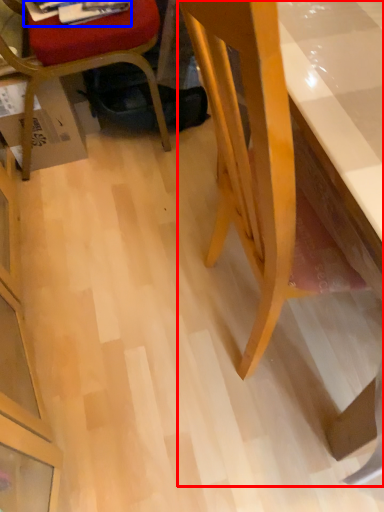
Question: Which object is closer to the camera taking this photo, desk (highlighted by a red box) or magazine (highlighted by a blue box)?

Choices:
 (A) desk
 (B) magazine

Answer: (A)